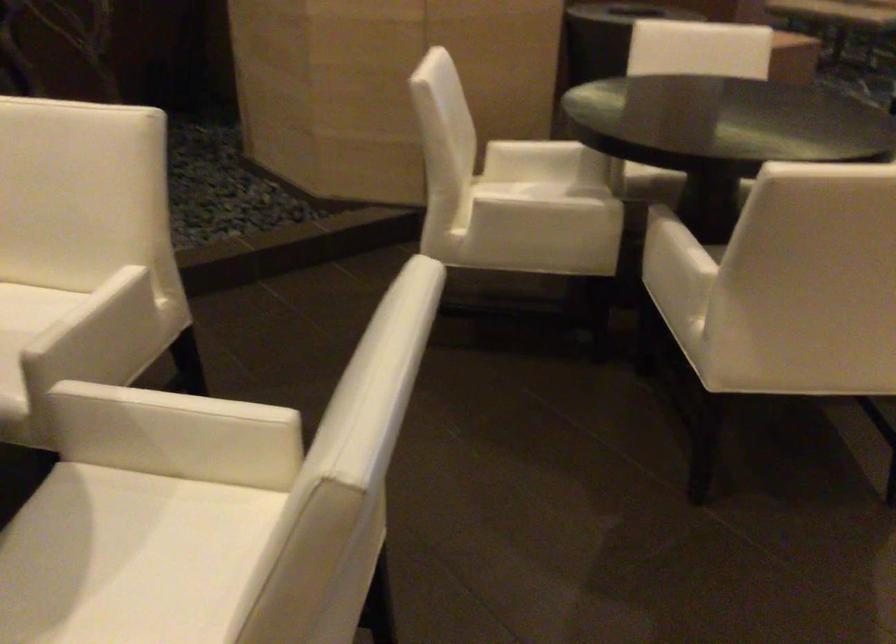
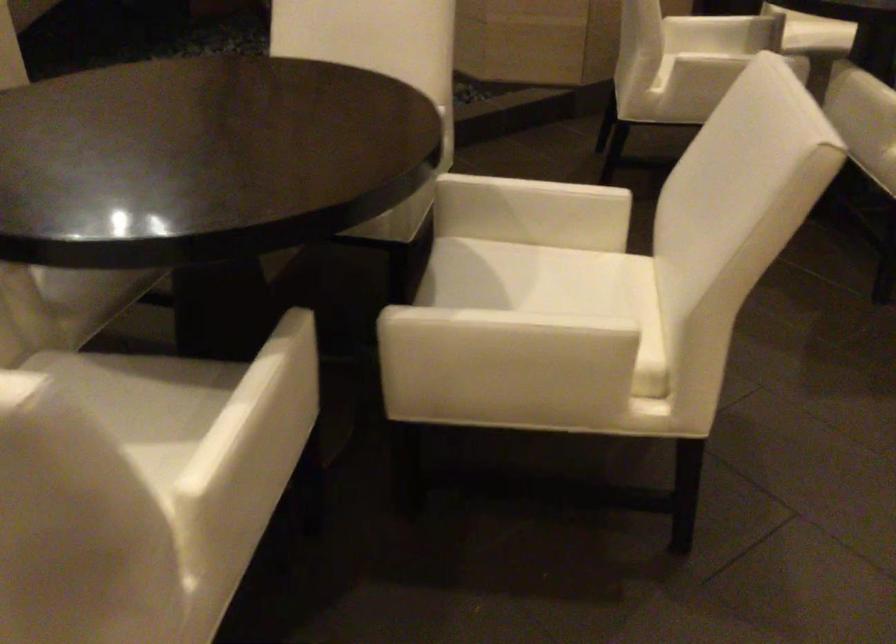
Where in the second image is the point corresponding to point 90,535 from the first image?

(490, 272)